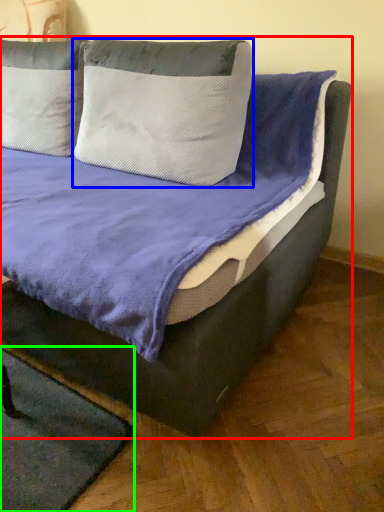
Question: Which object is the farthest from bed (highlighted by a red box)? Choose among these: pillow (highlighted by a blue box) or mat (highlighted by a green box).

Choices:
 (A) pillow
 (B) mat

Answer: (B)